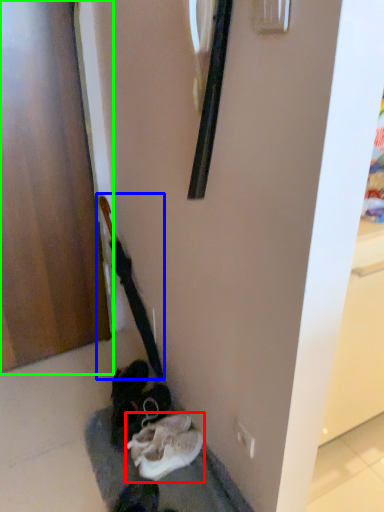
Question: Estimate the real-world distances between objects in this image. Which object is farther from footwear (highlighted by a red box), guitar (highlighted by a blue box) or door (highlighted by a green box)?

Choices:
 (A) guitar
 (B) door

Answer: (B)